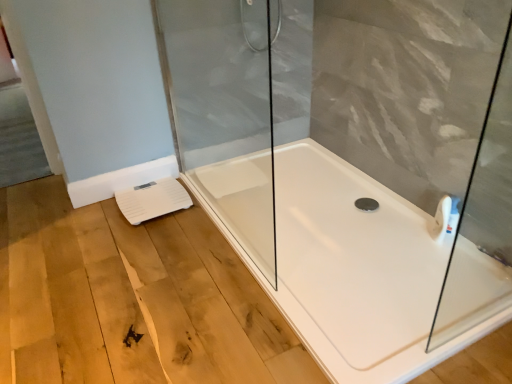
This screenshot has width=512, height=384. What are the coordinates of `free space in front of transparent glass shower door at center` in the screenshot? It's located at [230, 294].